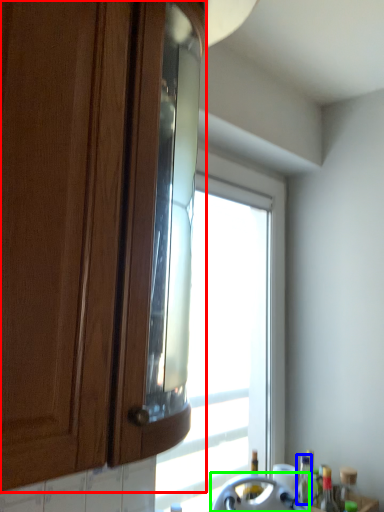
Question: Which is nearer to the cabinetry (highlighted by a red box)? bottle (highlighted by a blue box) or appliance (highlighted by a green box).

Choices:
 (A) bottle
 (B) appliance

Answer: (B)